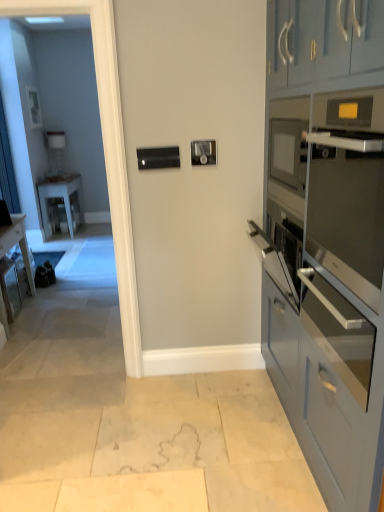
Question: Can you confirm if matte blue cabinets at right is smaller than satin silver oven at right, which is the second oven from bottom to top?

Choices:
 (A) no
 (B) yes

Answer: (A)

Question: Can you confirm if matte blue cabinets at right is wider than satin silver oven at right, which is the first oven in top-to-bottom order?

Choices:
 (A) yes
 (B) no

Answer: (A)

Question: Considering the relative sizes of matte blue cabinets at right and satin silver oven at right, which is the first oven in top-to-bottom order, in the image provided, is matte blue cabinets at right shorter than satin silver oven at right, which is the first oven in top-to-bottom order,?

Choices:
 (A) yes
 (B) no

Answer: (B)

Question: From a real-world perspective, is matte blue cabinets at right positioned over satin silver oven at right, which is the second oven from bottom to top, based on gravity?

Choices:
 (A) yes
 (B) no

Answer: (B)

Question: Would you say matte blue cabinets at right is outside satin silver oven at right, which is the first oven in top-to-bottom order?

Choices:
 (A) yes
 (B) no

Answer: (A)

Question: Relative to satin silver oven at right, the 1th oven positioned from the bottom, is wooden desk at left in front or behind?

Choices:
 (A) front
 (B) behind

Answer: (B)

Question: Considering the positions of point (16, 242) and point (306, 307), is point (16, 242) closer or farther from the camera than point (306, 307)?

Choices:
 (A) farther
 (B) closer

Answer: (A)

Question: In terms of size, does wooden desk at left appear bigger or smaller than satin silver oven at right, which is the second oven in top-to-bottom order?

Choices:
 (A) big
 (B) small

Answer: (A)

Question: Considering the relative positions of wooden desk at left and satin silver oven at right, the 1th oven positioned from the bottom, in the image provided, is wooden desk at left to the left or to the right of satin silver oven at right, the 1th oven positioned from the bottom,?

Choices:
 (A) left
 (B) right

Answer: (A)

Question: Is satin silver oven at right, the 1th oven positioned from the bottom, spatially inside transparent glass door at left, or outside of it?

Choices:
 (A) outside
 (B) inside

Answer: (A)

Question: Considering the positions of satin silver oven at right, the 1th oven positioned from the bottom, and transparent glass door at left in the image, is satin silver oven at right, the 1th oven positioned from the bottom, taller or shorter than transparent glass door at left?

Choices:
 (A) tall
 (B) short

Answer: (B)

Question: Considering the positions of satin silver oven at right, the 1th oven positioned from the bottom, and transparent glass door at left in the image, is satin silver oven at right, the 1th oven positioned from the bottom, bigger or smaller than transparent glass door at left?

Choices:
 (A) big
 (B) small

Answer: (B)

Question: From the image's perspective, is satin silver oven at right, which is the second oven in top-to-bottom order, located above or below transparent glass door at left?

Choices:
 (A) below
 (B) above

Answer: (A)

Question: Considering the positions of white glossy table at left and satin silver oven at right, which is the first oven in top-to-bottom order, in the image, is white glossy table at left wider or thinner than satin silver oven at right, which is the first oven in top-to-bottom order,?

Choices:
 (A) wide
 (B) thin

Answer: (A)

Question: Is white glossy table at left in front of or behind satin silver oven at right, which is the first oven in top-to-bottom order, in the image?

Choices:
 (A) behind
 (B) front

Answer: (A)